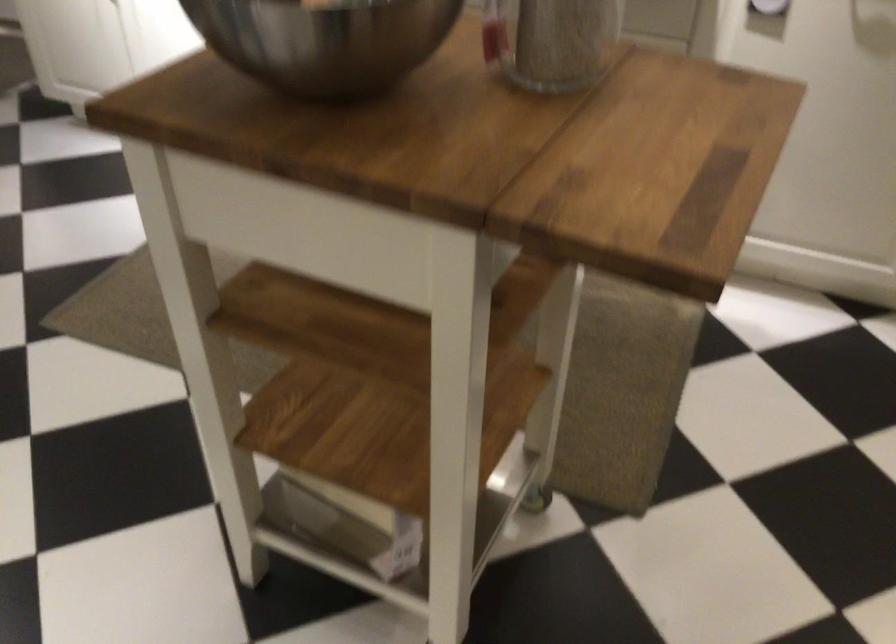
Locate an element on the screen. metal bowl is located at coordinates (323, 41).